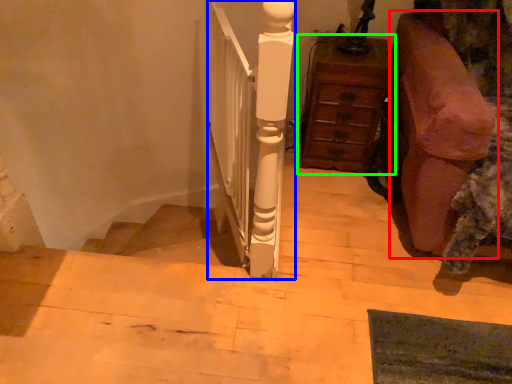
Question: Which object is positioned farthest from furniture (highlighted by a red box)? Select from rail (highlighted by a blue box) and chest of drawers (highlighted by a green box).

Choices:
 (A) rail
 (B) chest of drawers

Answer: (A)